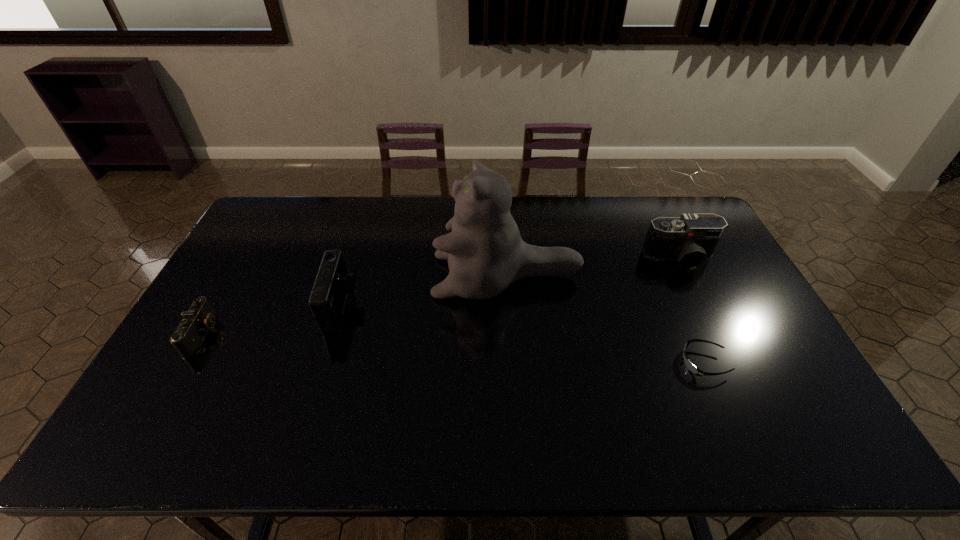
What are the coordinates of `blank space at the left edge of the desktop` in the screenshot? It's located at (173, 417).

This screenshot has width=960, height=540. Identify the location of vacant region at the right edge. (754, 350).

Find the location of a particular element. This screenshot has height=540, width=960. free area in between the shortest object and the rightmost camera is located at coordinates (692, 310).

Where is `vacant area that lies between the second object from left to right and the shortest object`? The height and width of the screenshot is (540, 960). vacant area that lies between the second object from left to right and the shortest object is located at coordinates (523, 335).

This screenshot has width=960, height=540. In order to click on empty space between the second camera from right to left and the tallest object in this screenshot , I will do `click(424, 292)`.

The width and height of the screenshot is (960, 540). Identify the location of free space between the second camera from left to right and the tallest object. pyautogui.click(x=424, y=292).

The image size is (960, 540). I want to click on free space between the rightmost camera and the shortest object, so click(692, 310).

Identify the location of free area in between the fourth object from right to left and the third object from left to right. The height and width of the screenshot is (540, 960). (424, 292).

This screenshot has width=960, height=540. In order to click on vacant area that lies between the fourth object from right to left and the shortest object in this screenshot , I will do `click(523, 335)`.

Locate an element on the screen. The height and width of the screenshot is (540, 960). object that ranks as the closest to the second object from left to right is located at coordinates (485, 252).